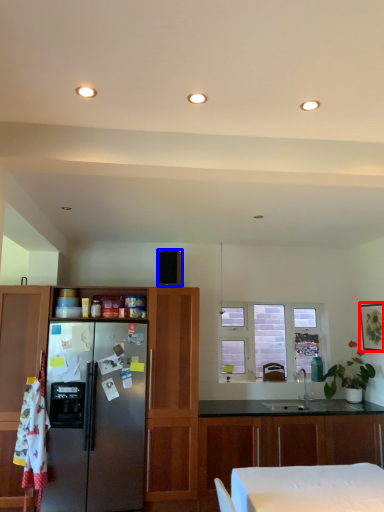
Question: Which point is further to the camera, picture frame (highlighted by a red box) or appliance (highlighted by a blue box)?

Choices:
 (A) picture frame
 (B) appliance

Answer: (A)